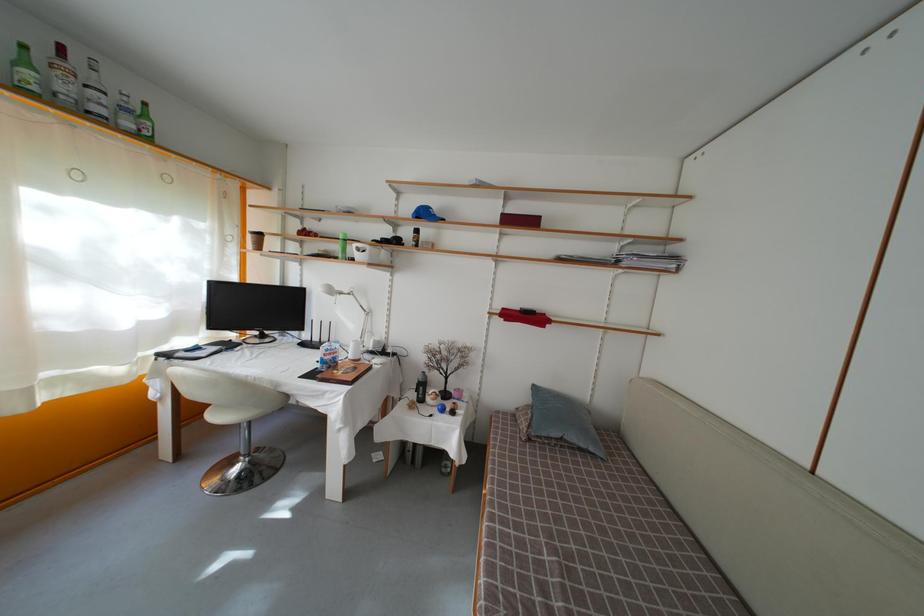
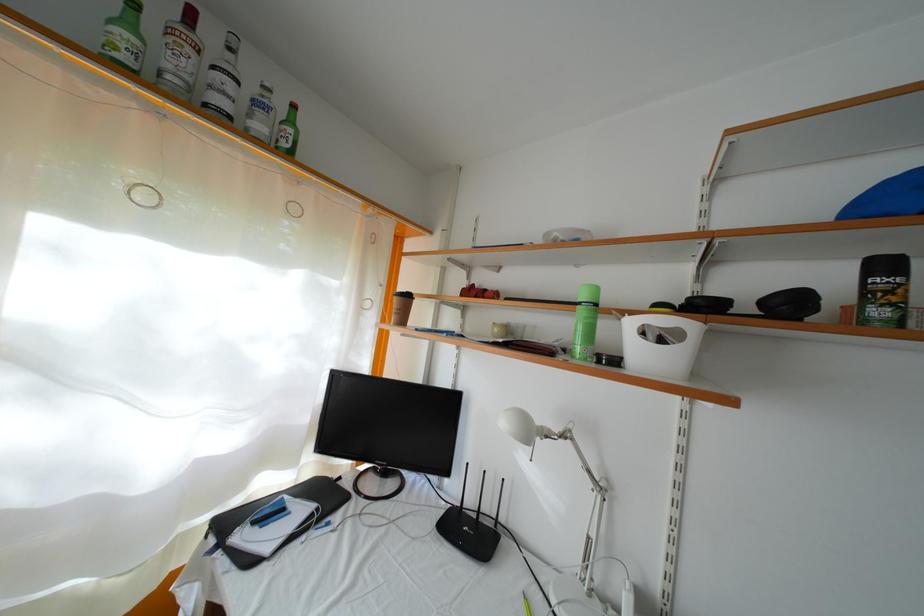
Find the pixel in the second image that matches (152,122) in the first image.

(297, 128)